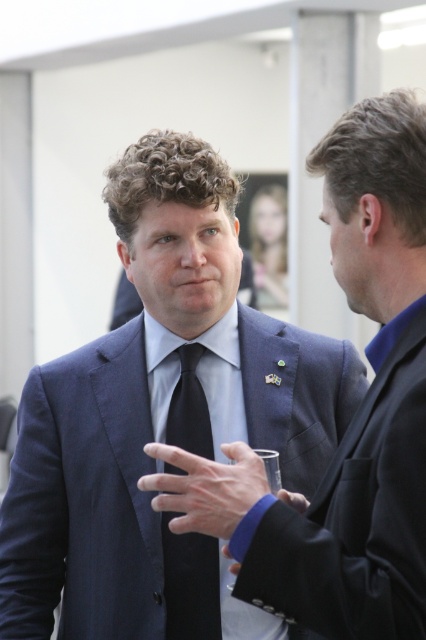
Question: Is the position of navy blue suit at center less distant than that of black silk tie at center?

Choices:
 (A) no
 (B) yes

Answer: (B)

Question: Does navy blue fabric suit at center appear on the right side of black silk tie at center?

Choices:
 (A) yes
 (B) no

Answer: (A)

Question: Which of the following is the farthest from the observer?

Choices:
 (A) navy blue suit at center
 (B) black silk tie at center

Answer: (B)

Question: Which object is the farthest from the navy blue fabric suit at center?

Choices:
 (A) navy blue suit at center
 (B) black silk tie at center

Answer: (B)

Question: Does navy blue suit at center appear on the left side of black silk tie at center?

Choices:
 (A) yes
 (B) no

Answer: (A)

Question: Which object is farther from the camera taking this photo?

Choices:
 (A) navy blue fabric suit at center
 (B) navy blue suit at center
 (C) black silk tie at center

Answer: (C)